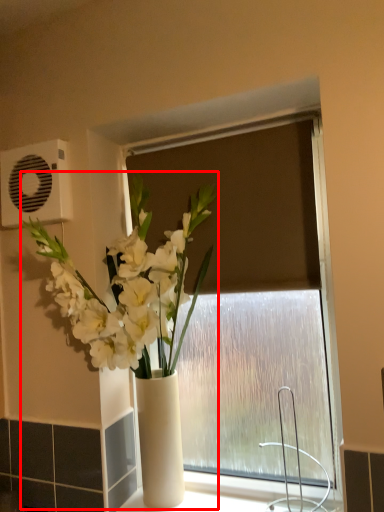
Question: From the image's perspective, what is the correct spatial positioning of houseplant (annotated by the red box) in reference to air conditioning?

Choices:
 (A) above
 (B) below

Answer: (B)